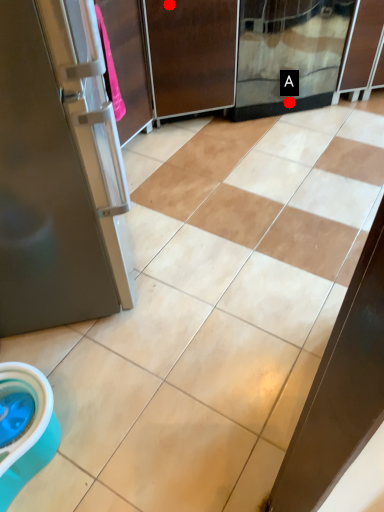
Question: Two points are circled on the image, labeled by A and B beside each circle. Which point is farther to the camera?

Choices:
 (A) A is further
 (B) B is further

Answer: (A)